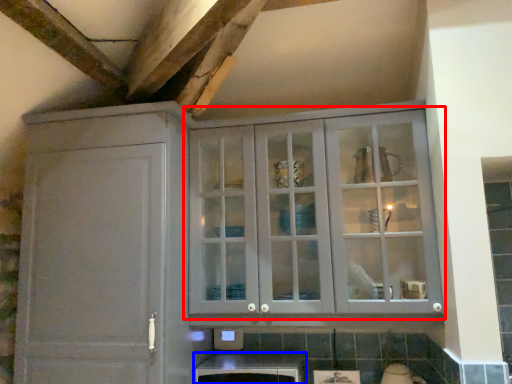
Question: Which point is further to the camera, cupboard (highlighted by a red box) or cabinetry (highlighted by a blue box)?

Choices:
 (A) cupboard
 (B) cabinetry

Answer: (B)